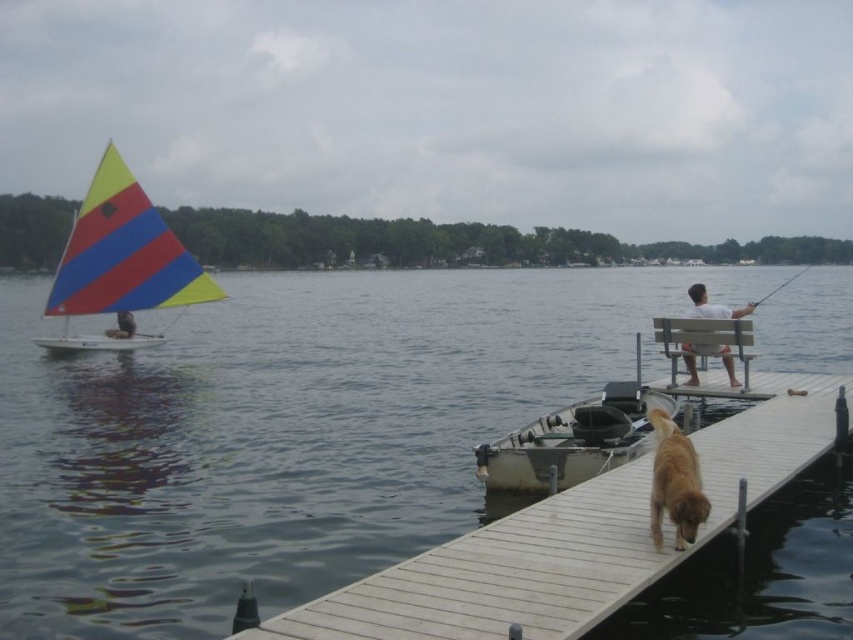
Does golden fur dog at lower right come in front of matte black sailboat at left?

Yes.

Does golden fur dog at lower right appear on the right side of matte black sailboat at left?

Yes, golden fur dog at lower right is to the right of matte black sailboat at left.

Identify the location of golden fur dog at lower right. (675, 483).

Does wooden dock at lower right appear on the left side of white wood bench at right?

Indeed, wooden dock at lower right is positioned on the left side of white wood bench at right.

Does wooden dock at lower right appear under white wood bench at right?

Indeed, wooden dock at lower right is positioned under white wood bench at right.

Is point (601, 602) more distant than point (730, 378)?

No, (601, 602) is closer to viewer.

At what (x,y) coordinates should I click in order to perform the action: click on wooden dock at lower right. Please return your answer as a coordinate pair (x, y). This screenshot has width=853, height=640. Looking at the image, I should click on (573, 538).

Who is higher up, white wood bench at right or smooth wooden fishing pole at right?

Positioned higher is smooth wooden fishing pole at right.

Which is more to the left, white wood bench at right or smooth wooden fishing pole at right?

From the viewer's perspective, white wood bench at right appears more on the left side.

Between point (685, 348) and point (807, 264), which one is positioned in front?

Point (685, 348) is more forward.

Identify the location of white wood bench at right. Image resolution: width=853 pixels, height=640 pixels. (712, 305).